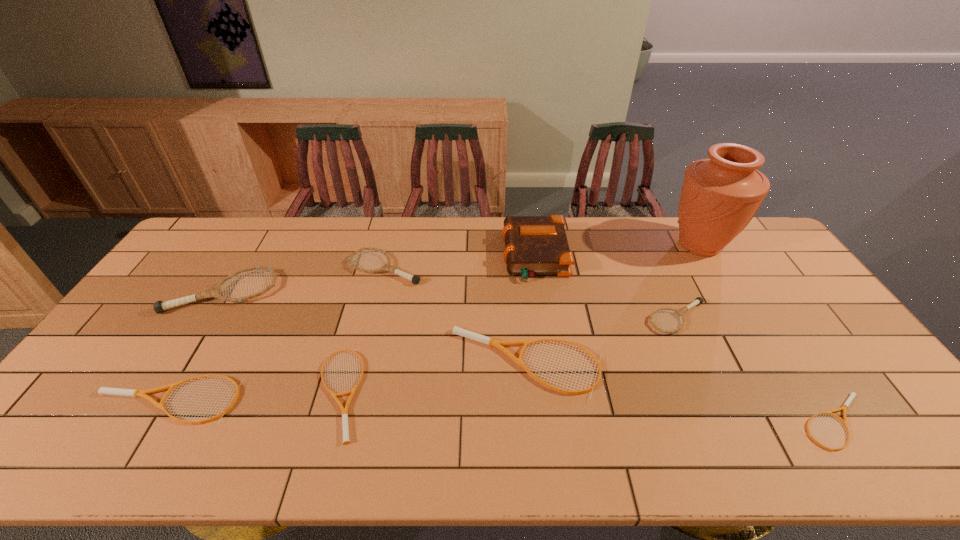
Locate an element on the screen. This screenshot has width=960, height=540. vacant space that's between the third tallest object and the biggest beige tennis racket is located at coordinates (375, 328).

Choose which object is the fourth nearest neighbor to the sixth shortest object. Please provide its 2D coordinates. Your answer should be formatted as a tuple, i.e. [(x, y)], where the tuple contains the x and y coordinates of a point satisfying the conditions above.

[(534, 245)]

Select which object is the seventh closest to the shortest object. Please provide its 2D coordinates. Your answer should be formatted as a tuple, i.e. [(x, y)], where the tuple contains the x and y coordinates of a point satisfying the conditions above.

[(103, 390)]

Image resolution: width=960 pixels, height=540 pixels. Find the location of `tennis racket that can be found as the fourth closest to the tallest object`. tennis racket that can be found as the fourth closest to the tallest object is located at coordinates (415, 279).

Locate an element on the screen. Image resolution: width=960 pixels, height=540 pixels. tennis racket that stands as the closest to the sixth shortest object is located at coordinates (159, 307).

Identify the location of gray tennis racket that stands as the second closest to the second smallest beige tennis racket. This screenshot has width=960, height=540. (415, 279).

Identify the location of gray tennis racket that can be found as the closest to the biggest beige tennis racket. This screenshot has width=960, height=540. (698, 300).

Find the location of a particular element. beige tennis racket that is the fourth closest to the Bible is located at coordinates (103, 390).

Select which beige tennis racket appears as the closest to the rightmost gray tennis racket. Please provide its 2D coordinates. Your answer should be formatted as a tuple, i.e. [(x, y)], where the tuple contains the x and y coordinates of a point satisfying the conditions above.

[(489, 341)]

Where is `vacant space that satisfies the following two spatial constraints: 1. on the spine side of the Bible; 2. on the left side of the smallest beige tennis racket`? vacant space that satisfies the following two spatial constraints: 1. on the spine side of the Bible; 2. on the left side of the smallest beige tennis racket is located at coordinates [x=559, y=423].